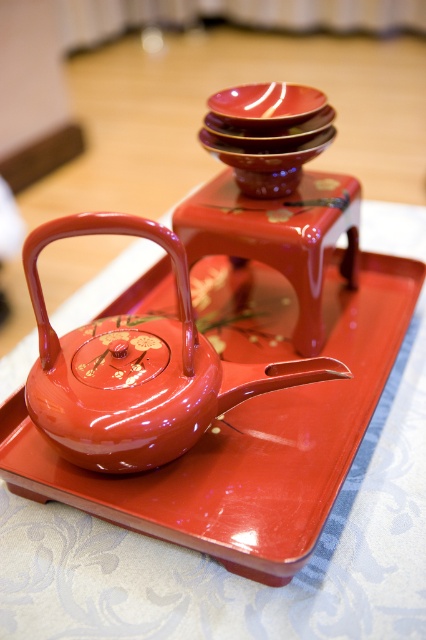
Question: Which point is farther from the camera taking this photo?

Choices:
 (A) (380, 499)
 (B) (282, 113)
 (C) (216, 412)

Answer: (B)

Question: From the image, what is the correct spatial relationship of glossy fabric tray at center in relation to glossy lacquer teapot at center?

Choices:
 (A) left
 (B) right

Answer: (B)

Question: Which point appears closest to the camera in this image?

Choices:
 (A) (265, 115)
 (B) (32, 586)
 (C) (71, 400)

Answer: (B)

Question: Among these points, which one is farthest from the camera?

Choices:
 (A) (235, 116)
 (B) (118, 355)

Answer: (A)

Question: Is glossy lacquer teapot at center below glossy ceramic plate at upper center?

Choices:
 (A) no
 (B) yes

Answer: (B)

Question: Can you confirm if glossy fabric tray at center is positioned to the right of glossy ceramic plate at upper center?

Choices:
 (A) yes
 (B) no

Answer: (B)